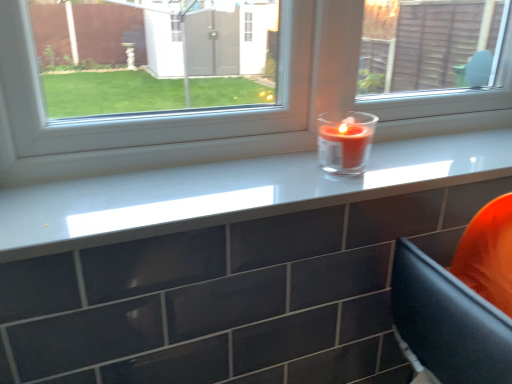
Find the location of `free spot to the left of translucent glass candle at center`. free spot to the left of translucent glass candle at center is located at coordinates (253, 172).